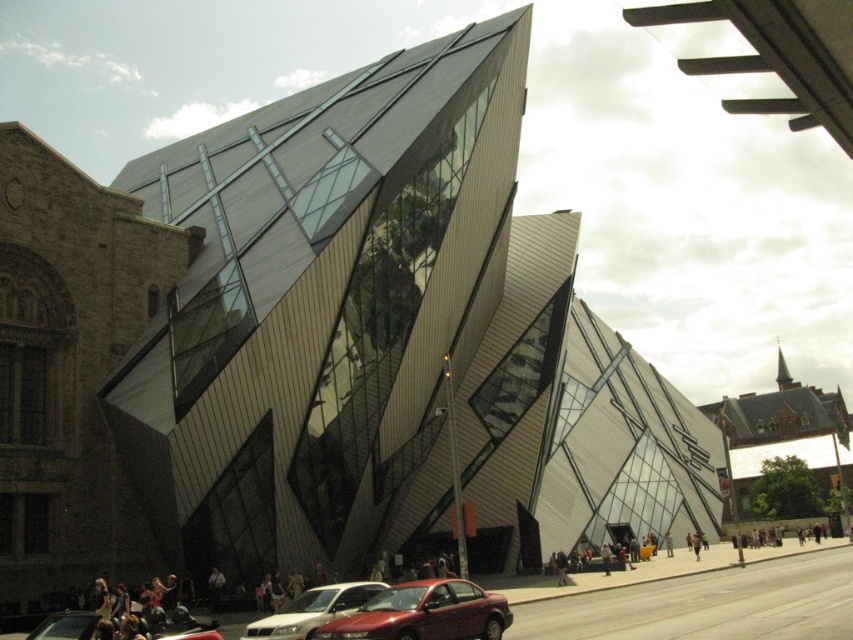
Question: Can you confirm if shiny red sedan at center is positioned below metallic red car at lower center?

Choices:
 (A) yes
 (B) no

Answer: (B)

Question: Which object is the farthest from the metallic red car at lower center?

Choices:
 (A) shiny red sedan at center
 (B) matte white sedan at lower center

Answer: (A)

Question: Which is nearer to the shiny red sedan at center?

Choices:
 (A) metallic red car at lower center
 (B) matte white sedan at lower center

Answer: (B)

Question: Which object is the farthest from the shiny red sedan at center?

Choices:
 (A) metallic red car at lower center
 (B) matte white sedan at lower center

Answer: (A)

Question: Does shiny red sedan at center have a lesser width compared to matte white sedan at lower center?

Choices:
 (A) no
 (B) yes

Answer: (A)

Question: Can you confirm if shiny red sedan at center is bigger than matte white sedan at lower center?

Choices:
 (A) no
 (B) yes

Answer: (B)